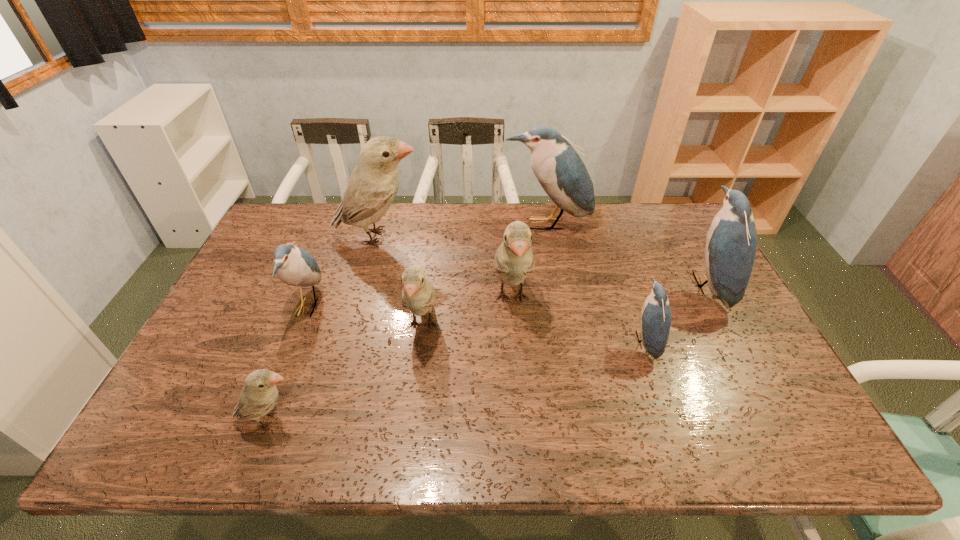
Where is `the farthest blue bird`? the farthest blue bird is located at coordinates (562, 174).

Locate an element on the screen. This screenshot has width=960, height=540. the second blue bird from left to right is located at coordinates (562, 174).

Identify the location of the biggest white bird. (372, 187).

Identify the location of the rightmost object. This screenshot has width=960, height=540. (731, 243).

The height and width of the screenshot is (540, 960). I want to click on the rightmost blue bird, so click(x=731, y=243).

Image resolution: width=960 pixels, height=540 pixels. Find the location of `the second biggest white bird`. the second biggest white bird is located at coordinates (514, 260).

The height and width of the screenshot is (540, 960). I want to click on the second smallest blue bird, so click(x=295, y=266).

The width and height of the screenshot is (960, 540). I want to click on the third biggest white bird, so click(418, 295).

At what (x,y) coordinates should I click in order to perform the action: click on the seventh object from left to right. Please return your answer as a coordinate pair (x, y). This screenshot has width=960, height=540. Looking at the image, I should click on (655, 322).

Where is `the second bird from right to left`? Image resolution: width=960 pixels, height=540 pixels. the second bird from right to left is located at coordinates (655, 322).